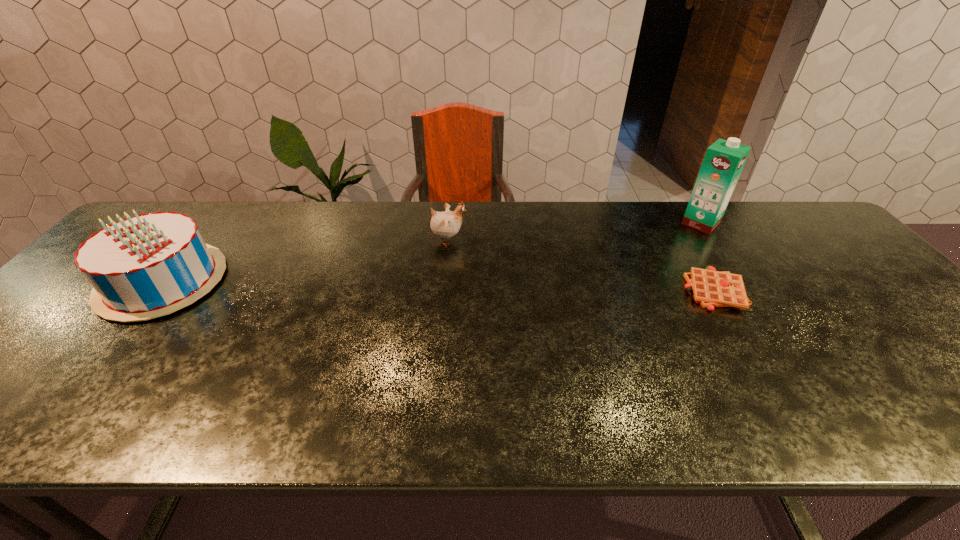
Identify the location of carton present at the far edge. The height and width of the screenshot is (540, 960). (724, 160).

The image size is (960, 540). I want to click on bird present at the far edge, so click(x=444, y=225).

Find the location of `object located at the left edge`. object located at the left edge is located at coordinates (143, 267).

Locate an element on the screen. The width and height of the screenshot is (960, 540). free space at the far edge is located at coordinates (320, 214).

You are a GUI agent. You are given a task and a screenshot of the screen. Output one action in this format:
    pyautogui.click(x=<x>, y=<y>)
    Task: Click on the vacant area at the near edge
    This screenshot has width=960, height=540.
    Given the screenshot: What is the action you would take?
    pyautogui.click(x=758, y=402)

Image resolution: width=960 pixels, height=540 pixels. In order to click on vacant space at the right edge of the desktop in this screenshot , I will do `click(937, 345)`.

Find the location of a particular element. This screenshot has width=960, height=540. vacant space at the near left corner of the desktop is located at coordinates (7, 435).

Find the location of `vacant space at the far right corner`. vacant space at the far right corner is located at coordinates pyautogui.click(x=781, y=218).

Where is `free space between the bird and the waffle`? free space between the bird and the waffle is located at coordinates (581, 266).

The width and height of the screenshot is (960, 540). In order to click on vacant area that lies between the third object from right to left and the waffle in this screenshot , I will do `click(581, 266)`.